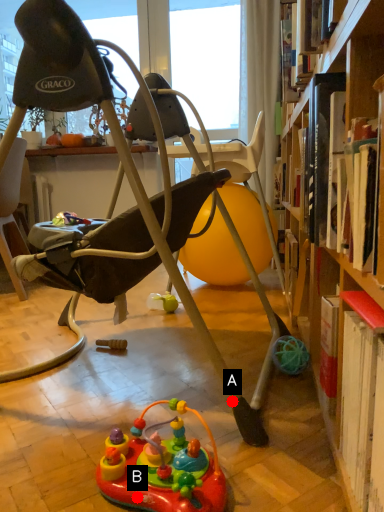
Question: Two points are circled on the image, labeled by A and B beside each circle. Which point is closer to the camera taking this photo?

Choices:
 (A) A is closer
 (B) B is closer

Answer: (B)